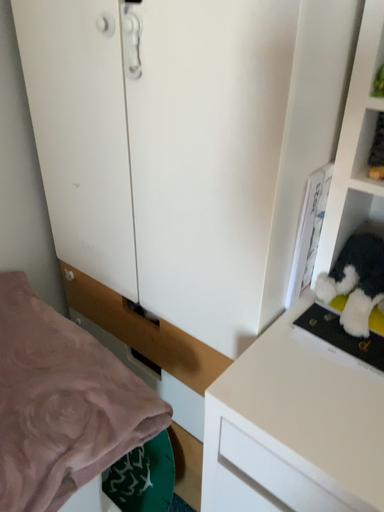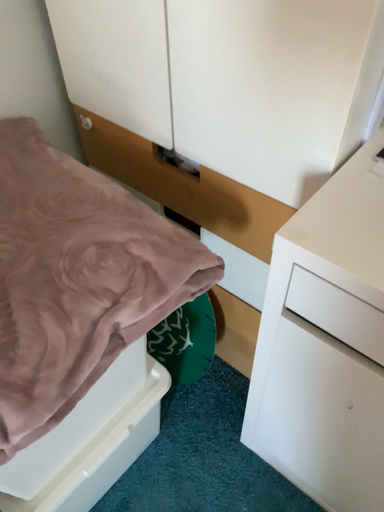
Question: How did the camera likely rotate when shooting the video?

Choices:
 (A) rotated downward
 (B) rotated upward

Answer: (A)